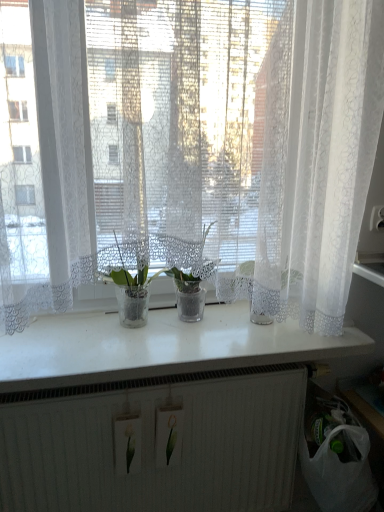
Where is `free location in front of clear glass vase at center, acting as the second houseplant starting from the right`? The image size is (384, 512). free location in front of clear glass vase at center, acting as the second houseplant starting from the right is located at coordinates (121, 351).